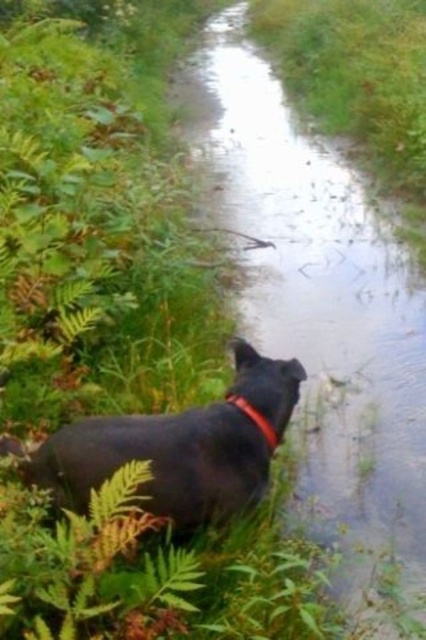
Question: Does clear water at center come in front of red nylon neckband at lower left?

Choices:
 (A) yes
 (B) no

Answer: (A)

Question: Which point is farther from the camera taking this photo?

Choices:
 (A) (238, 406)
 (B) (92, 436)

Answer: (A)

Question: Does clear water at center appear over red nylon neckband at lower left?

Choices:
 (A) yes
 (B) no

Answer: (A)

Question: Which point is closer to the camera taking this photo?

Choices:
 (A) 351,381
 (B) 212,420
 (C) 230,401

Answer: (B)

Question: Does clear water at center appear under red nylon neckband at lower left?

Choices:
 (A) yes
 (B) no

Answer: (B)

Question: Which point is farther to the camera?

Choices:
 (A) (123, 464)
 (B) (189, 124)

Answer: (B)